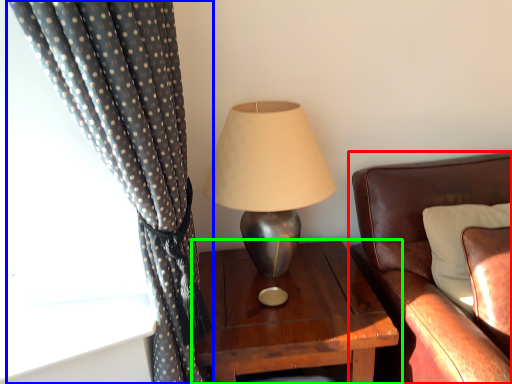
Question: Based on their relative distances, which object is farther from studio couch (highlighted by a red box)? Choose from curtain (highlighted by a blue box) and nightstand (highlighted by a green box).

Choices:
 (A) curtain
 (B) nightstand

Answer: (A)